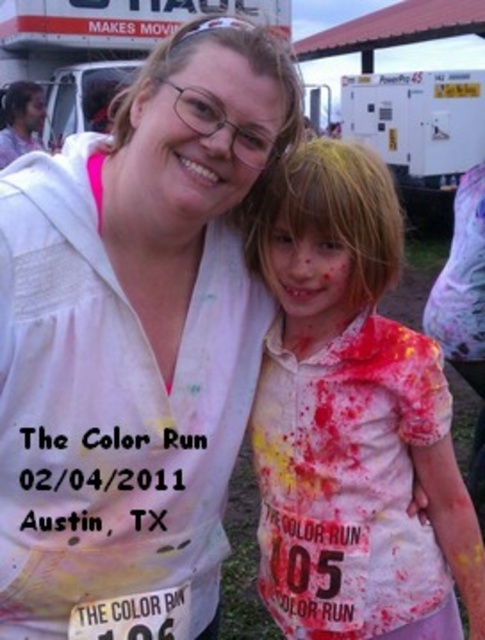
Question: Is speckled paint shirt at center closer to camera compared to matte painted face at center?

Choices:
 (A) yes
 (B) no

Answer: (A)

Question: Which point is farther to the camera?

Choices:
 (A) matte white face at upper center
 (B) speckled paint shirt at center
 (C) matte white face at center
 (D) matte painted face at center

Answer: (A)

Question: Is white matte shirt at upper left thinner than matte white face at upper center?

Choices:
 (A) yes
 (B) no

Answer: (B)

Question: Among these objects, which one is farthest from the camera?

Choices:
 (A) matte white face at center
 (B) speckled paint shirt at center

Answer: (B)

Question: Which point is closer to the camera?

Choices:
 (A) matte white face at upper center
 (B) matte painted face at center
 (C) speckled paint shirt at center
 (D) white matte shirt at upper left

Answer: (D)

Question: Can you confirm if matte white face at center is positioned below matte white face at upper center?

Choices:
 (A) no
 (B) yes

Answer: (B)